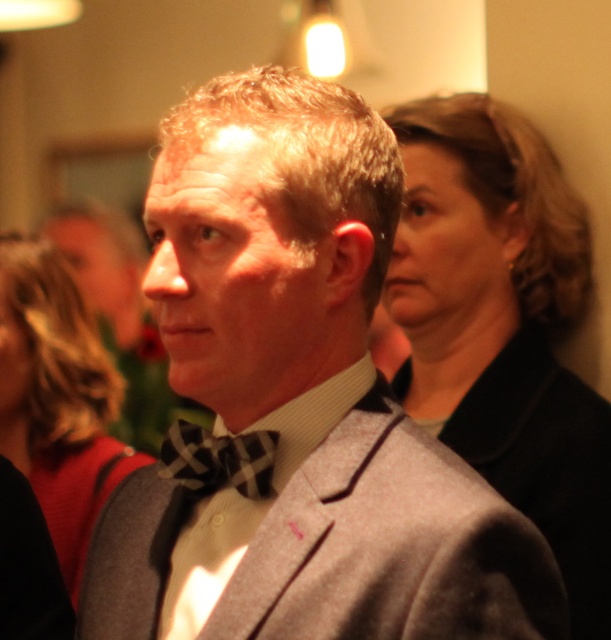
Question: Does gray wool suit at center have a lesser width compared to smooth black jacket at upper right?

Choices:
 (A) yes
 (B) no

Answer: (B)

Question: Based on their relative distances, which object is nearer to the gray wool suit at center?

Choices:
 (A) plaid fabric bow tie at center
 (B) gray woolen blazer at center
 (C) smooth black jacket at upper right

Answer: (B)

Question: Is gray wool suit at center below plaid fabric bow tie at center?

Choices:
 (A) no
 (B) yes

Answer: (A)

Question: Does smooth black jacket at upper right have a greater width compared to gray woolen blazer at center?

Choices:
 (A) yes
 (B) no

Answer: (B)

Question: Which point is closer to the camera?

Choices:
 (A) (271, 147)
 (B) (535, 404)
 (C) (240, 488)
 (D) (156, 572)

Answer: (A)

Question: Among these objects, which one is farthest from the camera?

Choices:
 (A) gray woolen blazer at center
 (B) smooth black jacket at upper right
 (C) plaid fabric bow tie at center
 (D) gray wool suit at center

Answer: (B)